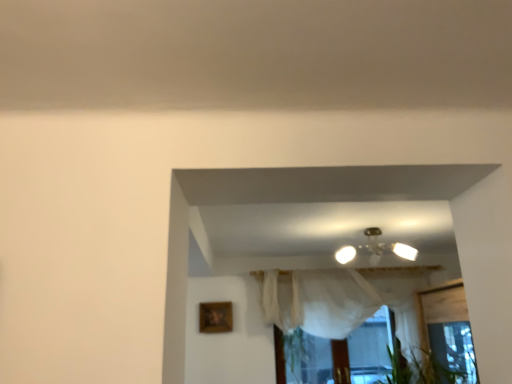
Question: Is wooden picture frame at lower left further to the viewer compared to metallic glass chandelier at center?

Choices:
 (A) yes
 (B) no

Answer: (A)

Question: Does wooden picture frame at lower left have a greater height compared to metallic glass chandelier at center?

Choices:
 (A) yes
 (B) no

Answer: (A)

Question: Considering the relative positions of wooden picture frame at lower left and metallic glass chandelier at center in the image provided, is wooden picture frame at lower left to the right of metallic glass chandelier at center from the viewer's perspective?

Choices:
 (A) no
 (B) yes

Answer: (A)

Question: Can you confirm if wooden picture frame at lower left is smaller than metallic glass chandelier at center?

Choices:
 (A) no
 (B) yes

Answer: (B)

Question: Could metallic glass chandelier at center be considered to be inside wooden picture frame at lower left?

Choices:
 (A) no
 (B) yes

Answer: (A)

Question: Is metallic glass chandelier at center situated inside wooden picture frame at lower left or outside?

Choices:
 (A) inside
 (B) outside

Answer: (B)

Question: From the image's perspective, is metallic glass chandelier at center located above or below wooden picture frame at lower left?

Choices:
 (A) below
 (B) above

Answer: (B)

Question: Is metallic glass chandelier at center taller or shorter than wooden picture frame at lower left?

Choices:
 (A) tall
 (B) short

Answer: (B)

Question: In terms of width, does metallic glass chandelier at center look wider or thinner when compared to wooden picture frame at lower left?

Choices:
 (A) wide
 (B) thin

Answer: (A)

Question: Is white sheer curtain at center inside the boundaries of metallic glass chandelier at center, or outside?

Choices:
 (A) inside
 (B) outside

Answer: (B)

Question: From the image's perspective, is white sheer curtain at center positioned above or below metallic glass chandelier at center?

Choices:
 (A) above
 (B) below

Answer: (B)

Question: Is point (301, 307) positioned closer to the camera than point (378, 241)?

Choices:
 (A) closer
 (B) farther

Answer: (B)

Question: From a real-world perspective, is white sheer curtain at center physically located above or below metallic glass chandelier at center?

Choices:
 (A) above
 (B) below

Answer: (B)

Question: In the image, is white sheer curtain at center positioned in front of or behind wooden picture frame at lower left?

Choices:
 (A) front
 (B) behind

Answer: (A)

Question: In terms of width, does white sheer curtain at center look wider or thinner when compared to wooden picture frame at lower left?

Choices:
 (A) thin
 (B) wide

Answer: (B)